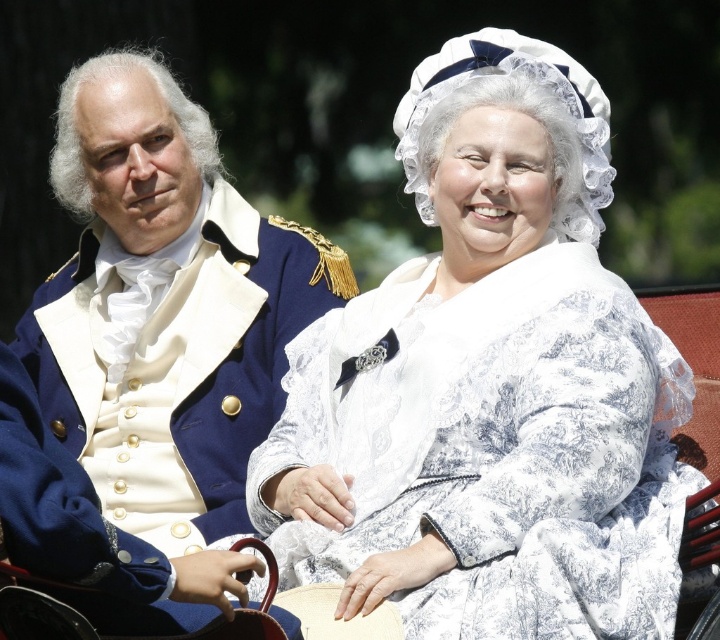
Can you confirm if white lace dress at center is positioned below blue wool coat at left?

Yes.

Does point (474, 483) come in front of point (171, 173)?

Yes, it is.

Describe the element at coordinates (490, 385) in the screenshot. I see `white lace dress at center` at that location.

In order to click on white lace dress at center in this screenshot , I will do `click(490, 385)`.